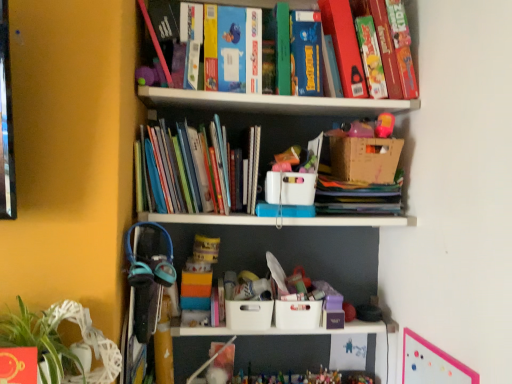
Question: From a real-world perspective, is white wicker swivel chair at lower left positioned above or below hardcover book at upper right, the 1th book in the top-to-bottom sequence?

Choices:
 (A) below
 (B) above

Answer: (A)

Question: From the image's perspective, is white wicker swivel chair at lower left positioned above or below hardcover book at upper right, the second book in the left-to-right sequence?

Choices:
 (A) below
 (B) above

Answer: (A)

Question: Estimate the real-world distances between objects in this image. Which object is closer to the white plastic basket at center, the first storage box from the top?

Choices:
 (A) multicolored paperbacks at center, the second book when ordered from top to bottom
 (B) white wicker swivel chair at lower left
 (C) pink matte bulletin board at upper right
 (D) hardcover book at upper right, the 2th book from the bottom
 (E) white plastic storage box at center, acting as the 1th storage box starting from the bottom

Answer: (A)

Question: Considering the real-world distances, which object is closest to the hardcover book at upper right, the 1th book in the top-to-bottom sequence?

Choices:
 (A) white plastic basket at center, the third storage box positioned from the bottom
 (B) matte pink toy at upper right
 (C) cardboard box at upper right
 (D) white plastic storage box at center, the third storage box viewed from the top
 (E) multicolored paperbacks at center, which appears as the 1th book when ordered from the bottom

Answer: (B)